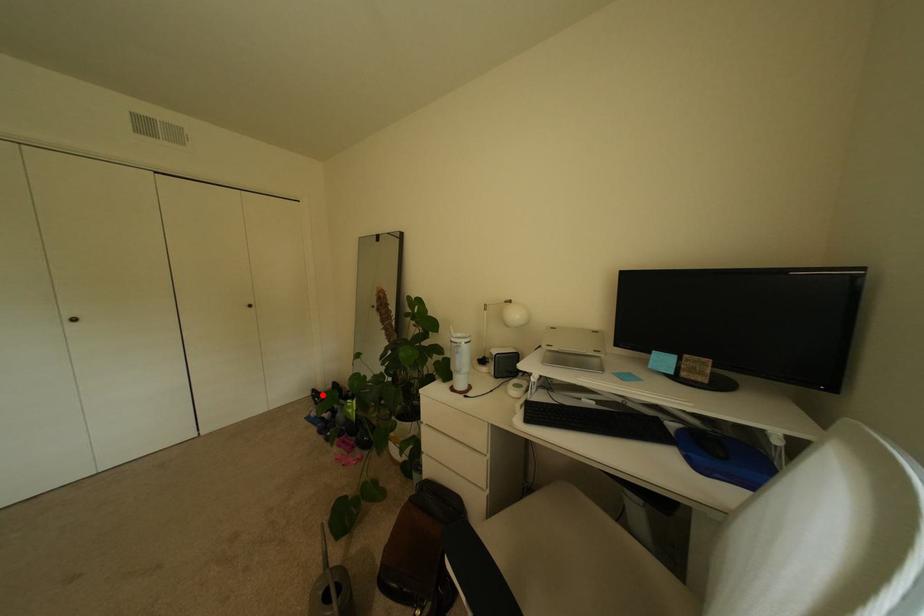
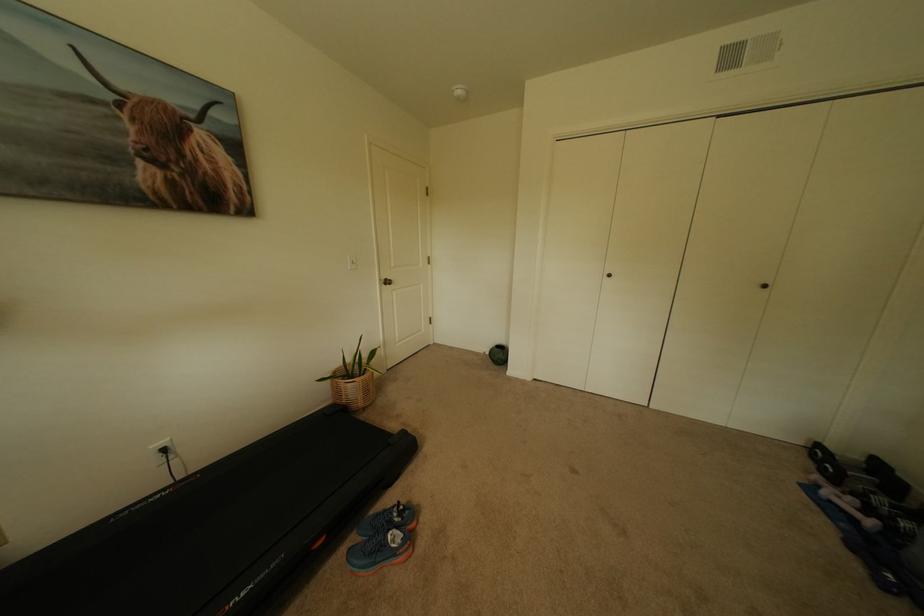
Question: I am providing you with two images of the same scene from different viewpoints. A red point is shown in image1. For the corresponding object point in image2, is it positioned nearer or farther from the camera?

Choices:
 (A) Nearer
 (B) Farther

Answer: (A)